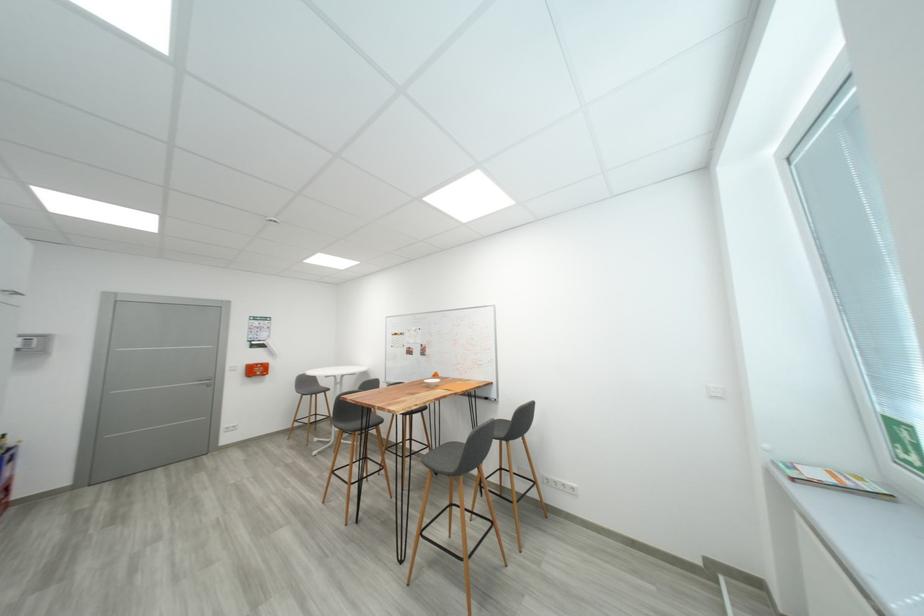
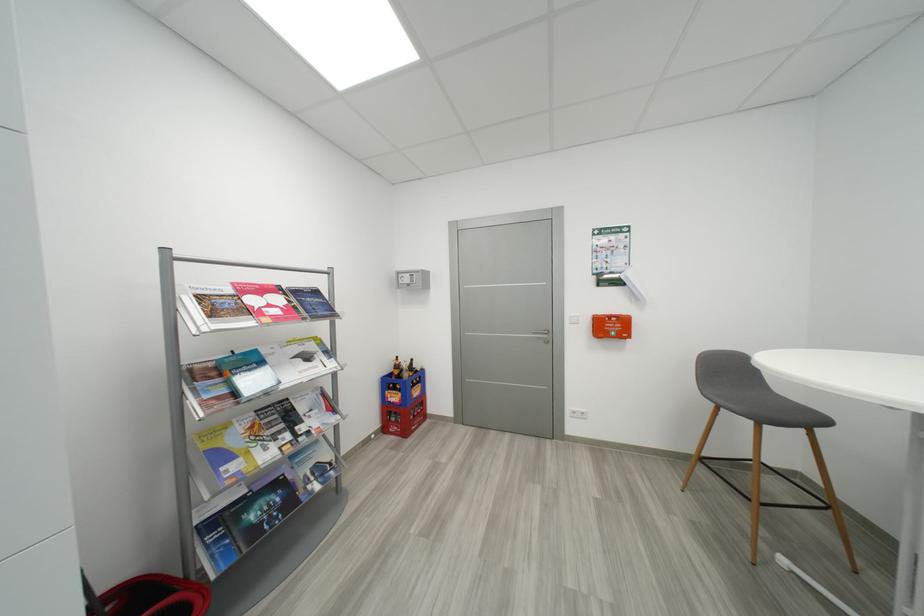
The point at (335, 392) is marked in the first image. Where is the corresponding point in the second image?

(833, 424)